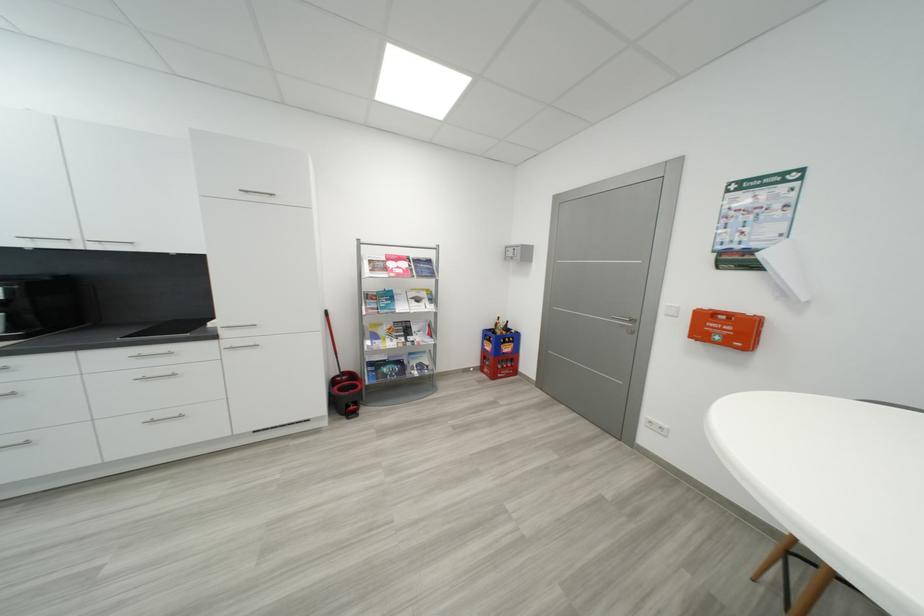
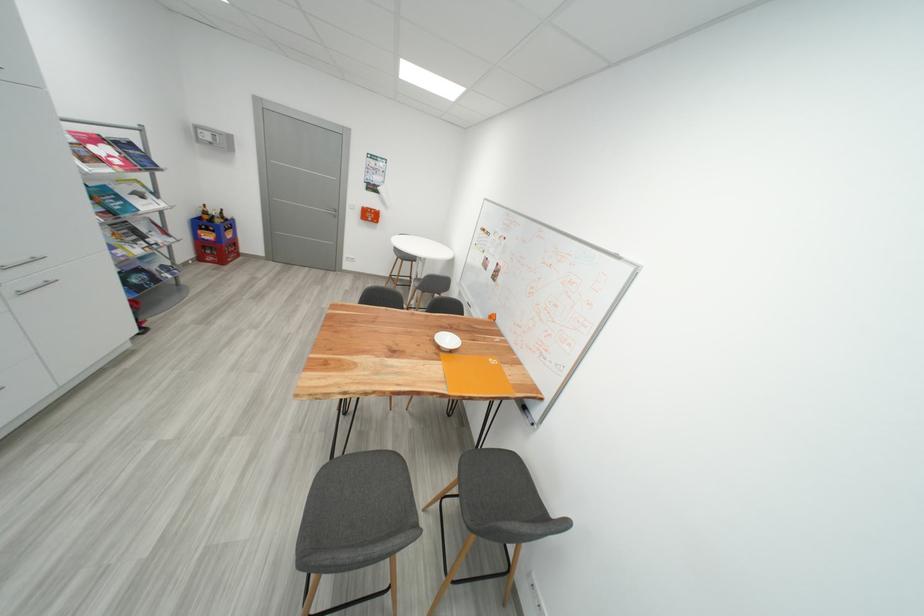
Locate, in the second image, the point that corresponds to pixel 394 302 in the first image.

(122, 201)